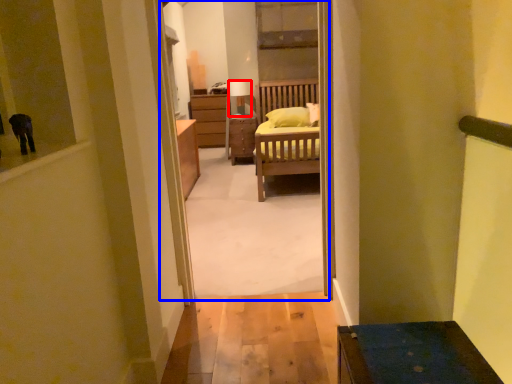
Question: Which object appears closest to the camera in this image, lamp (highlighted by a red box) or corridor (highlighted by a blue box)?

Choices:
 (A) lamp
 (B) corridor

Answer: (B)